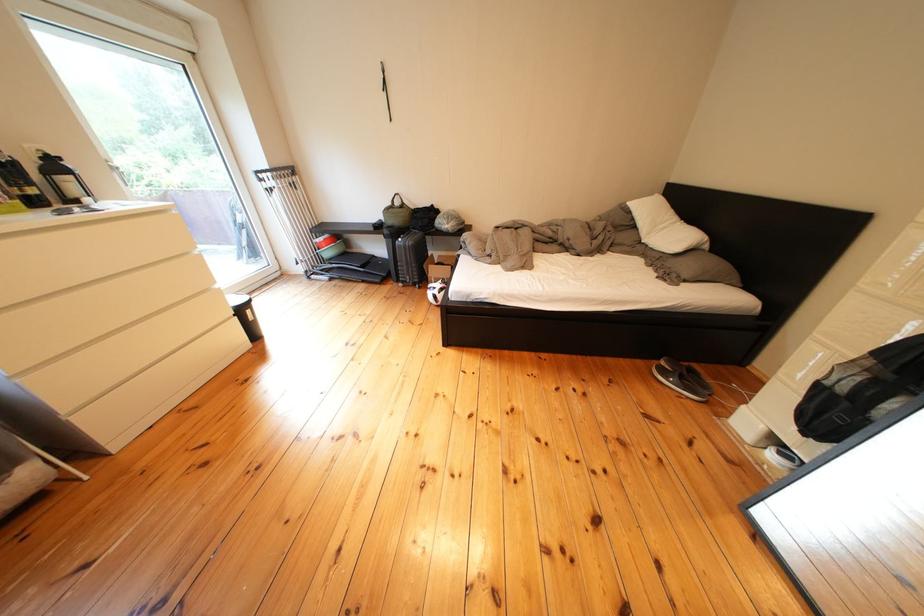
Find where to lift the black suitcase. Please return your answer as a coordinate pair (x, y).

(409, 257)